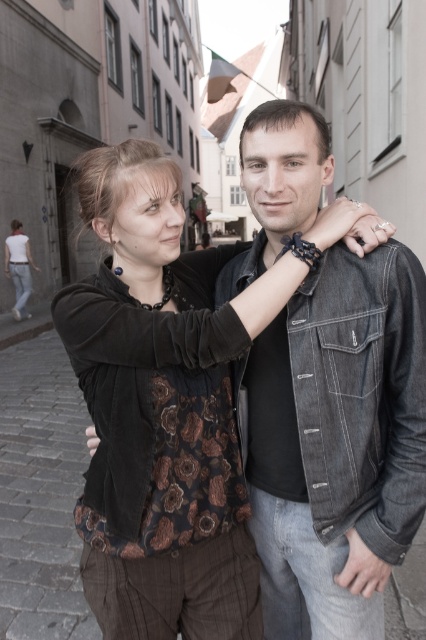
You are a fashion designer observing two people on a cobblestone street. You notice the matte black jacket at center and the matte black jacket at lower left. Which one is positioned to the right side of the other?

The matte black jacket at center is to the right of the matte black jacket at lower left.

You are a tailor who needs to determine which jacket, the matte black jacket at center or the denim jacket at center, requires more fabric for alterations. Based on the image, which jacket would you prioritize for requiring more fabric due to its size?

The denim jacket at center requires more fabric for alterations because it is taller than the matte black jacket at center.

Consider the image. You are a tailor trying to fit jackets for two customers. The denim jacket at center is for the customer on the left, and the matte black jacket at lower left is for the customer on the right. Which jacket has a larger size?

The matte black jacket at lower left is larger than the denim jacket at center.